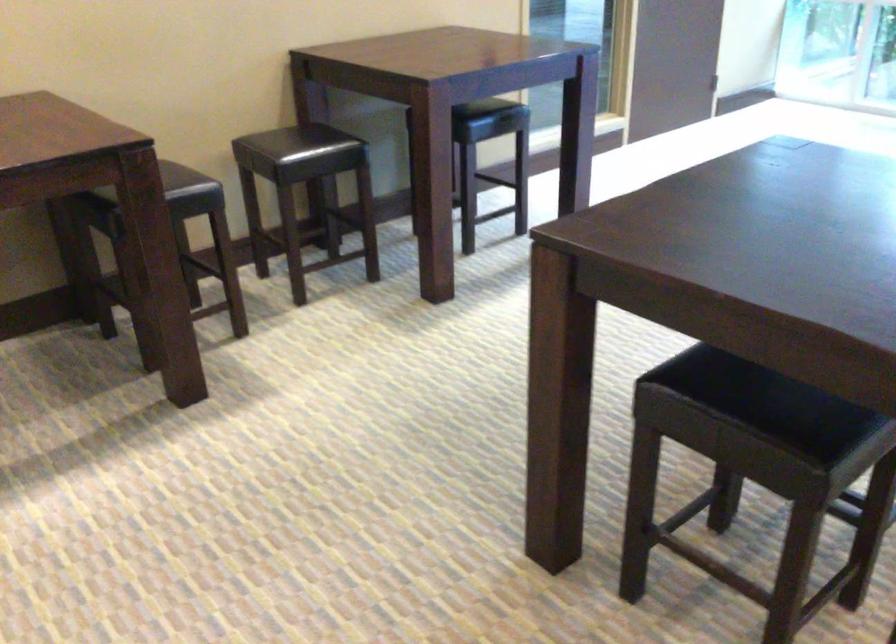
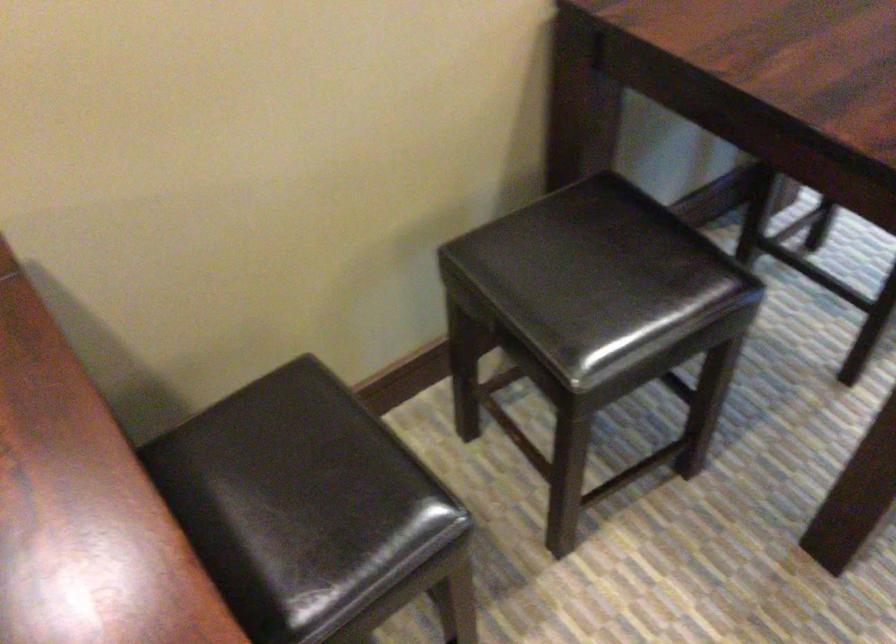
In a continuous first-person perspective shot, in which direction is the camera moving?

The movement direction of the cameraman is left, forward.